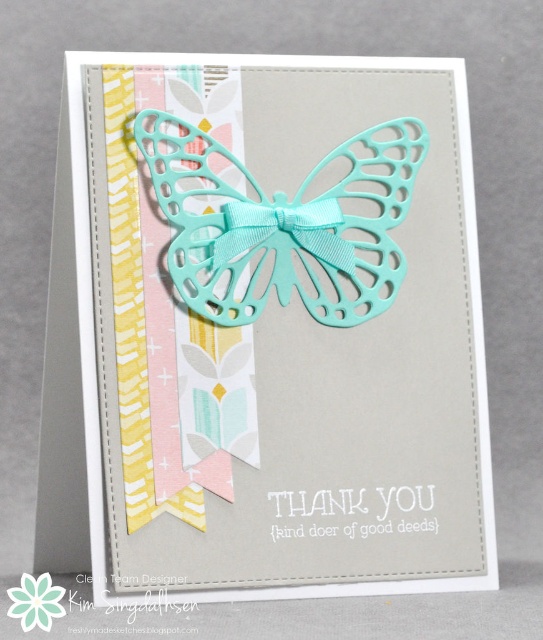
Looking at this image, who is positioned more to the left, matte teal butterfly at upper center or mint glossy butterfly at center?

Positioned to the left is matte teal butterfly at upper center.

Between point (305, 170) and point (365, 301), which one is positioned in front?

Point (365, 301) is more forward.

Find the location of a particular element. matte teal butterfly at upper center is located at coordinates (280, 326).

Does matte teal butterfly at upper center have a lesser width compared to tiffany blue grosgrain ribbon at center?

Incorrect, matte teal butterfly at upper center's width is not less than tiffany blue grosgrain ribbon at center's.

Is matte teal butterfly at upper center bigger than tiffany blue grosgrain ribbon at center?

Yes.

At what (x,y) coordinates should I click in order to perform the action: click on matte teal butterfly at upper center. Please return your answer as a coordinate pair (x, y). The height and width of the screenshot is (640, 543). Looking at the image, I should click on (280, 326).

Can you confirm if mint glossy butterfly at center is positioned to the right of tiffany blue grosgrain ribbon at center?

Yes, mint glossy butterfly at center is to the right of tiffany blue grosgrain ribbon at center.

Does point (175, 227) come behind point (319, 252)?

No, it is not.

Find the location of a particular element. The image size is (543, 640). mint glossy butterfly at center is located at coordinates (282, 221).